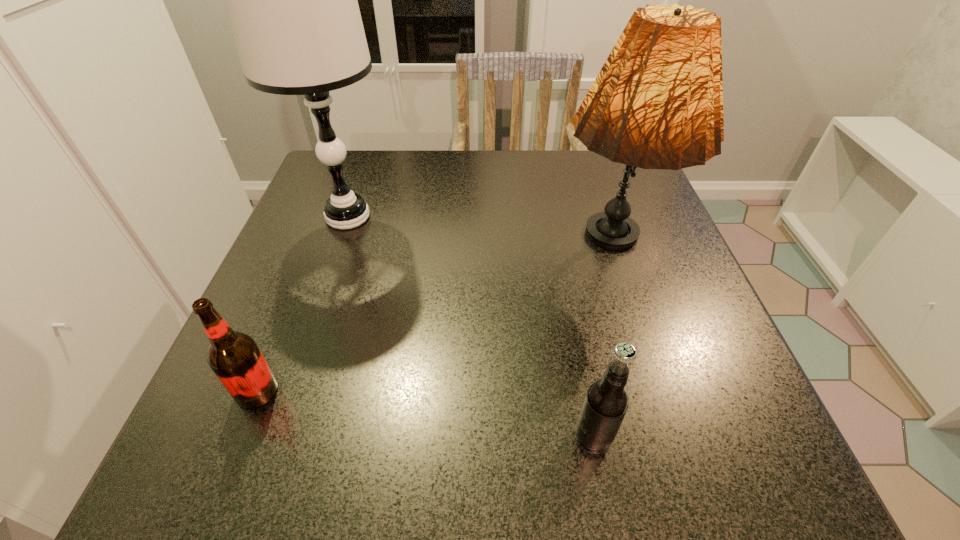
What are the coordinates of `vacant region between the farther root beer and the table lamp` in the screenshot? It's located at (302, 304).

The width and height of the screenshot is (960, 540). In order to click on free spot between the farther root beer and the second tallest object in this screenshot , I will do `click(432, 325)`.

Image resolution: width=960 pixels, height=540 pixels. I want to click on free space between the nearest object and the second nearest object, so click(x=425, y=414).

Identify the location of empty space that is in between the third shortest object and the left root beer. (432, 325).

Image resolution: width=960 pixels, height=540 pixels. I want to click on free spot between the table lamp and the right root beer, so click(470, 327).

Locate an element on the screen. The image size is (960, 540). empty location between the right root beer and the lampshade is located at coordinates (600, 348).

Identify which object is the nearest to the lampshade. Please provide its 2D coordinates. Your answer should be formatted as a tuple, i.e. [(x, y)], where the tuple contains the x and y coordinates of a point satisfying the conditions above.

[(606, 402)]

Choose which object is the second nearest neighbor to the table lamp. Please provide its 2D coordinates. Your answer should be formatted as a tuple, i.e. [(x, y)], where the tuple contains the x and y coordinates of a point satisfying the conditions above.

[(657, 103)]

Where is `vacant space that satisfies the following two spatial constraints: 1. on the front-facing side of the lampshade; 2. on the label of the nearer root beer`? This screenshot has height=540, width=960. vacant space that satisfies the following two spatial constraints: 1. on the front-facing side of the lampshade; 2. on the label of the nearer root beer is located at coordinates (661, 437).

Find the location of `vacant point that satisfies the following two spatial constraints: 1. on the front-facing side of the second tallest object; 2. on the label of the nearest object`. vacant point that satisfies the following two spatial constraints: 1. on the front-facing side of the second tallest object; 2. on the label of the nearest object is located at coordinates (661, 437).